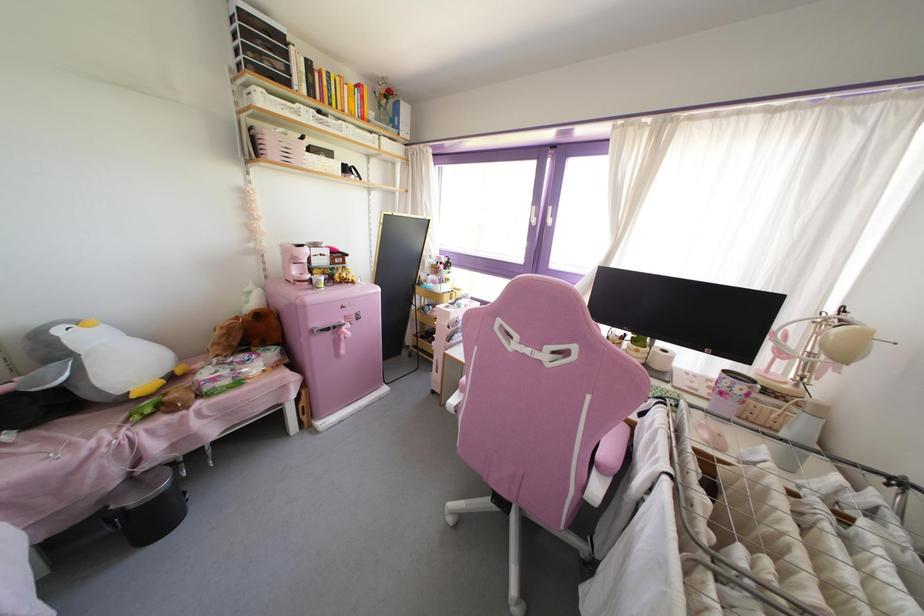
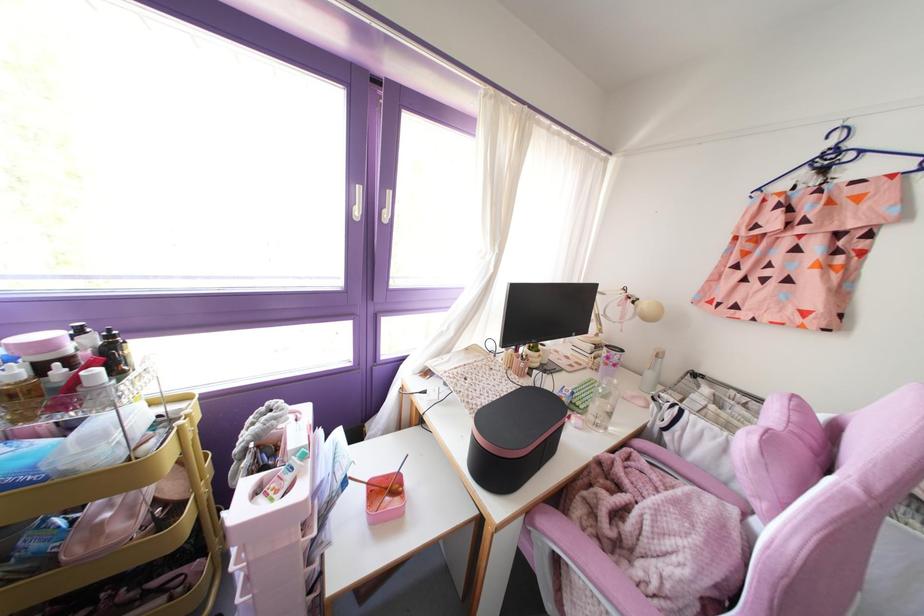
Locate, in the second image, the point that corresponds to (444,268) in the first image.

(116, 373)